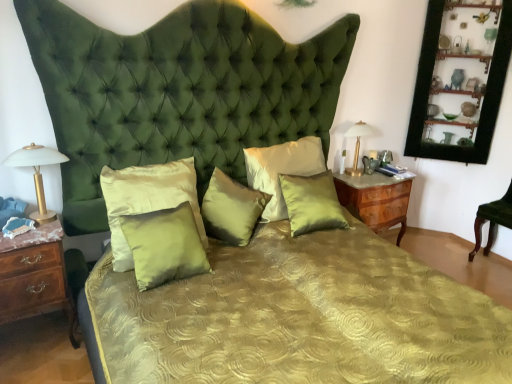
This screenshot has width=512, height=384. What are the coordinates of `satin green pillow at center, positioned as the third pillow in right-to-left order` in the screenshot? It's located at (231, 209).

This screenshot has width=512, height=384. In order to click on matte gold table lamp at left, the 2th bedside lamp viewed from the back in this screenshot , I will do `click(37, 173)`.

This screenshot has width=512, height=384. Identify the location of wooden nightstand at left, the 1th nightstand when ordered from front to back. (35, 276).

How much space does gold metallic lamp at right, positioned as the first bedside lamp in back-to-front order, occupy horizontally?

It is 5.69 inches.

The image size is (512, 384). Describe the element at coordinates (459, 81) in the screenshot. I see `black wood picture frame at upper right` at that location.

This screenshot has width=512, height=384. Identify the location of satin green pillow at center, the third pillow in the left-to-right sequence. (231, 209).

At what (x,y) coordinates should I click in order to perform the action: click on the 5th pillow located beneath the black wood picture frame at upper right (from a real-world perspective). Please return your answer as a coordinate pair (x, y). This screenshot has width=512, height=384. Looking at the image, I should click on (164, 246).

From the image's perspective, is satin green pillow at center, positioned as the 4th pillow in right-to-left order, on black wood picture frame at upper right?

Actually, satin green pillow at center, positioned as the 4th pillow in right-to-left order, appears below black wood picture frame at upper right in the image.

Looking at this image, does satin green pillow at center, arranged as the second pillow when viewed from the left, have a greater width compared to black wood picture frame at upper right?

No.

Based on the photo, would you say satin green pillow at center, the first pillow when ordered from right to left, contains satin green pillow at center, arranged as the second pillow when viewed from the left?

Actually, satin green pillow at center, arranged as the second pillow when viewed from the left, is outside satin green pillow at center, the first pillow when ordered from right to left.

From the image's perspective, which pillow is the 3rd one above the satin green pillow at center, positioned as the 4th pillow in right-to-left order? Please provide its 2D coordinates.

[(312, 203)]

Considering the relative positions of satin green pillow at center, which appears as the fifth pillow when viewed from the left, and satin green pillow at center, positioned as the 4th pillow in right-to-left order, in the image provided, is satin green pillow at center, which appears as the fifth pillow when viewed from the left, to the left of satin green pillow at center, positioned as the 4th pillow in right-to-left order, from the viewer's perspective?

Incorrect, satin green pillow at center, which appears as the fifth pillow when viewed from the left, is not on the left side of satin green pillow at center, positioned as the 4th pillow in right-to-left order.

Which point is more distant from viewer, [361,170] or [130,244]?

The point [361,170] is farther from the camera.

From a real-world perspective, between gold metallic lamp at right, positioned as the first bedside lamp in back-to-front order, and satin green pillow at center, positioned as the 4th pillow in right-to-left order, who is vertically higher?

gold metallic lamp at right, positioned as the first bedside lamp in back-to-front order, is physically above.

Considering the relative sizes of gold metallic lamp at right, which is the second bedside lamp from front to back, and satin green pillow at center, positioned as the 4th pillow in right-to-left order, in the image provided, is gold metallic lamp at right, which is the second bedside lamp from front to back, bigger than satin green pillow at center, positioned as the 4th pillow in right-to-left order,?

Incorrect, gold metallic lamp at right, which is the second bedside lamp from front to back, is not larger than satin green pillow at center, positioned as the 4th pillow in right-to-left order.

From the image's perspective, is gold metallic lamp at right, the 2th bedside lamp when ordered from left to right, above satin green pillow at center, positioned as the 4th pillow in right-to-left order?

Yes.

From a real-world perspective, is green velvet chair at lower right below wooden nightstand at left, positioned as the second nightstand in right-to-left order?

No, from a real-world perspective, green velvet chair at lower right is not under wooden nightstand at left, positioned as the second nightstand in right-to-left order.

Based on the photo, is green velvet chair at lower right aimed at wooden nightstand at left, the 1th nightstand when ordered from front to back?

Yes, green velvet chair at lower right is facing wooden nightstand at left, the 1th nightstand when ordered from front to back.

Which of these two, green velvet chair at lower right or wooden nightstand at left, marked as the first nightstand in a left-to-right arrangement, is bigger?

With larger size is green velvet chair at lower right.

Considering the points (507, 209) and (50, 251), which point is behind, point (507, 209) or point (50, 251)?

The point (507, 209) is farther.

Is wooden nightstand at left, positioned as the second nightstand in right-to-left order, facing towards satin green pillow at center, the third pillow in the left-to-right sequence?

No, wooden nightstand at left, positioned as the second nightstand in right-to-left order, is not oriented towards satin green pillow at center, the third pillow in the left-to-right sequence.

Which of these two, wooden nightstand at left, placed as the 2th nightstand when sorted from back to front, or satin green pillow at center, the third pillow in the left-to-right sequence, stands taller?

Standing taller between the two is wooden nightstand at left, placed as the 2th nightstand when sorted from back to front.

Between wooden nightstand at left, marked as the first nightstand in a left-to-right arrangement, and satin green pillow at center, positioned as the third pillow in right-to-left order, which one appears on the right side from the viewer's perspective?

Positioned to the right is satin green pillow at center, positioned as the third pillow in right-to-left order.

Considering the relative sizes of wooden nightstand at left, positioned as the second nightstand in right-to-left order, and satin green pillow at center, the third pillow in the left-to-right sequence, in the image provided, is wooden nightstand at left, positioned as the second nightstand in right-to-left order, thinner than satin green pillow at center, the third pillow in the left-to-right sequence,?

In fact, wooden nightstand at left, positioned as the second nightstand in right-to-left order, might be wider than satin green pillow at center, the third pillow in the left-to-right sequence.

Is satin green pillow at center, positioned as the third pillow in right-to-left order, located outside satin green pillow at center, arranged as the second pillow when viewed from the left?

Indeed, satin green pillow at center, positioned as the third pillow in right-to-left order, is completely outside satin green pillow at center, arranged as the second pillow when viewed from the left.

Can you tell me how much satin green pillow at center, positioned as the third pillow in right-to-left order, and satin green pillow at center, arranged as the second pillow when viewed from the left, differ in facing direction?

The angular difference between satin green pillow at center, positioned as the third pillow in right-to-left order, and satin green pillow at center, arranged as the second pillow when viewed from the left, is 36.2 degrees.

Does point (264, 200) come in front of point (139, 269)?

No, (264, 200) is further to viewer.

Which is in front, satin green pillow at center, the third pillow in the left-to-right sequence, or satin green pillow at center, positioned as the 4th pillow in right-to-left order?

satin green pillow at center, positioned as the 4th pillow in right-to-left order, is in front.

I want to click on bedside lamp on the right of satin green pillow at center, positioned as the third pillow in right-to-left order, so coord(357,145).

Does point (247, 201) come behind point (356, 160)?

That is False.

Could you tell me if satin green pillow at center, the third pillow in the left-to-right sequence, is turned towards gold metallic lamp at right, positioned as the first bedside lamp in back-to-front order?

No, satin green pillow at center, the third pillow in the left-to-right sequence, is not oriented towards gold metallic lamp at right, positioned as the first bedside lamp in back-to-front order.

From a real-world perspective, does satin green pillow at center, the third pillow in the left-to-right sequence, sit lower than gold metallic lamp at right, which is the second bedside lamp from front to back?

Indeed, from a real-world perspective, satin green pillow at center, the third pillow in the left-to-right sequence, is positioned beneath gold metallic lamp at right, which is the second bedside lamp from front to back.

Identify the location of the 5th pillow below the black wood picture frame at upper right (from a real-world perspective). (164, 246).

The width and height of the screenshot is (512, 384). Find the location of `the 3rd pillow counting from the right of the satin green pillow at center, positioned as the 4th pillow in right-to-left order`. the 3rd pillow counting from the right of the satin green pillow at center, positioned as the 4th pillow in right-to-left order is located at coordinates (312, 203).

From the image, which object appears to be nearer to gold metallic lamp at right, the 2th bedside lamp when ordered from left to right, satin/velvet pillow at center, acting as the fifth pillow starting from the right, or wooden nightstand at left, placed as the 2th nightstand when sorted from back to front?

The object closer to gold metallic lamp at right, the 2th bedside lamp when ordered from left to right, is satin/velvet pillow at center, acting as the fifth pillow starting from the right.

Consider the image. Estimate the real-world distances between objects in this image. Which object is further from gold metallic lamp at right, positioned as the first bedside lamp in back-to-front order, satin green pillow at center, acting as the second pillow starting from the right, or satin/velvet pillow at center, which is counted as the first pillow, starting from the left?

satin/velvet pillow at center, which is counted as the first pillow, starting from the left, is further to gold metallic lamp at right, positioned as the first bedside lamp in back-to-front order.

Based on their spatial positions, is satin/velvet pillow at center, acting as the fifth pillow starting from the right, or wooden nightstand at left, placed as the 2th nightstand when sorted from back to front, further from green velvet chair at lower right?

Among the two, wooden nightstand at left, placed as the 2th nightstand when sorted from back to front, is located further to green velvet chair at lower right.

When comparing their distances from satin green pillow at center, which appears as the fifth pillow when viewed from the left, does satin/velvet pillow at center, acting as the fifth pillow starting from the right, or satin green pillow at center, positioned as the third pillow in right-to-left order, seem closer?

satin green pillow at center, positioned as the third pillow in right-to-left order, is closer to satin green pillow at center, which appears as the fifth pillow when viewed from the left.

Looking at the image, which one is located closer to black wood picture frame at upper right, satin/velvet pillow at center, acting as the fifth pillow starting from the right, or wooden nightstand at left, marked as the first nightstand in a left-to-right arrangement?

The object closer to black wood picture frame at upper right is satin/velvet pillow at center, acting as the fifth pillow starting from the right.

From the image, which object appears to be farther from satin green pillow at center, which appears as the fifth pillow when viewed from the left, matte gold table lamp at left, the second bedside lamp in the right-to-left sequence, or satin/velvet pillow at center, which is counted as the first pillow, starting from the left?

Based on the image, matte gold table lamp at left, the second bedside lamp in the right-to-left sequence, appears to be further to satin green pillow at center, which appears as the fifth pillow when viewed from the left.

Based on their spatial positions, is gold metallic lamp at right, the 2th bedside lamp when ordered from left to right, or satin/velvet pillow at center, which is counted as the first pillow, starting from the left, closer to wooden nightstand at right, which is the 2th nightstand in front-to-back order?

Among the two, gold metallic lamp at right, the 2th bedside lamp when ordered from left to right, is located nearer to wooden nightstand at right, which is the 2th nightstand in front-to-back order.

Based on their spatial positions, is satin/velvet pillow at center, which is counted as the first pillow, starting from the left, or satin green pillow at center, positioned as the 4th pillow in right-to-left order, further from green velvet chair at lower right?

Among the two, satin/velvet pillow at center, which is counted as the first pillow, starting from the left, is located further to green velvet chair at lower right.

Find the location of `bedside lamp between satin green pillow at center, arranged as the second pillow when viewed from the left, and black wood picture frame at upper right, in the horizontal direction`. bedside lamp between satin green pillow at center, arranged as the second pillow when viewed from the left, and black wood picture frame at upper right, in the horizontal direction is located at coordinates (357, 145).

Image resolution: width=512 pixels, height=384 pixels. What are the coordinates of `bedside lamp between wooden nightstand at left, marked as the first nightstand in a left-to-right arrangement, and satin green pillow at center, the third pillow in the left-to-right sequence, in the horizontal direction` in the screenshot? It's located at (37, 173).

I want to click on picture frame between gold metallic lamp at right, positioned as the first bedside lamp in back-to-front order, and green velvet chair at lower right, in the horizontal direction, so tap(459, 81).

Find the location of a particular element. The width and height of the screenshot is (512, 384). pillow between satin green pillow at center, positioned as the third pillow in right-to-left order, and satin green pillow at center, which appears as the fifth pillow when viewed from the left is located at coordinates (282, 170).